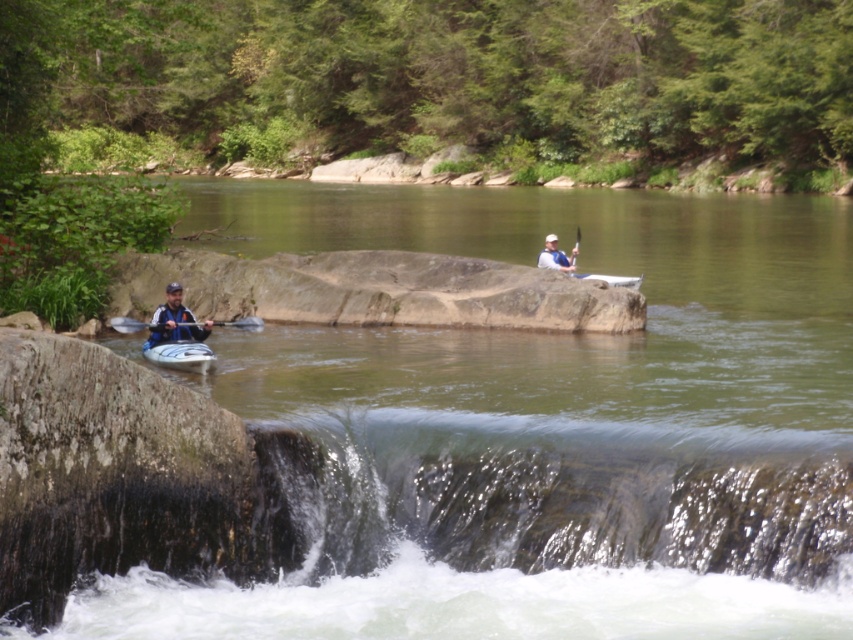
You are a photographer positioned at the waterfall and want to capture both the matte blue kayak at left and the blue plastic paddle at left in the same frame. Based on their positions, which object should you adjust your camera to focus on first to ensure both are in the shot?

The matte blue kayak at left is to the right of the blue plastic paddle at left, so you should focus on the blue plastic paddle at left first to ensure both objects are in the frame.

You are a kayaker preparing to launch your kayak into the river. You see the white matte kayak at upper center and the smooth blue paddle at upper center. Which object is closer to you?

The white matte kayak at upper center is closer to you since it is only 11.54 feet away from the smooth blue paddle at upper center, but the question is about which is closer to you. Wait, the description says the kayak is 11.54 feet away from the paddle. Since both are at upper center, perhaps the kayak is part of the same kayak setup? Hmm, maybe I need to recheck the rules. The answer should use the Objects Description to state the distance between them, but the question asks which is closer to the user.